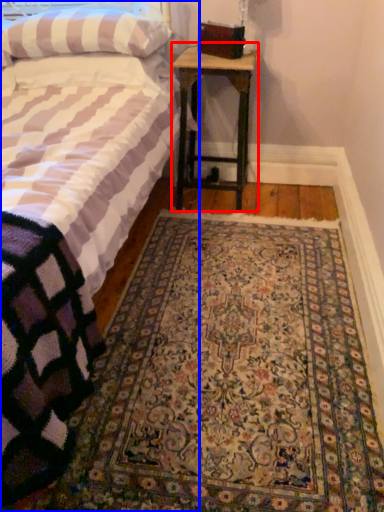
Question: Which object is further to the camera taking this photo, nightstand (highlighted by a red box) or bed (highlighted by a blue box)?

Choices:
 (A) nightstand
 (B) bed

Answer: (A)